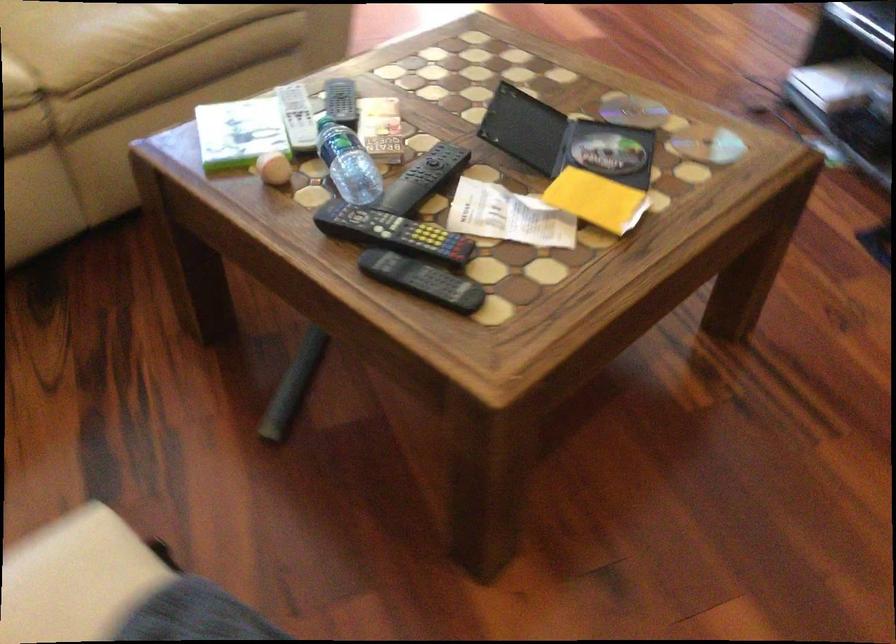
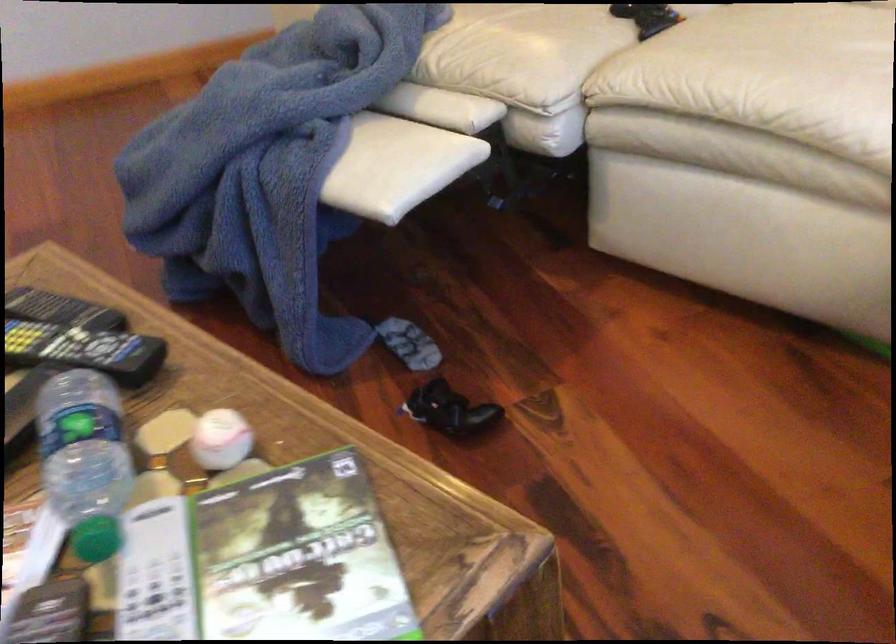
The point at (383, 205) is marked in the first image. Where is the corresponding point in the second image?

(84, 350)